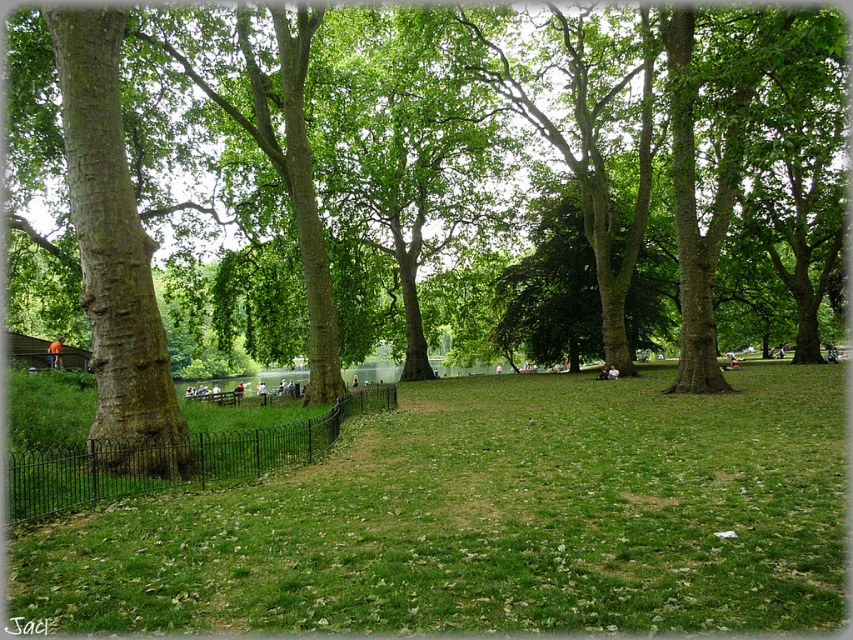
You are a gardener planning to plant a new tree in the park. You have a small sapling that needs space to grow. Based on the image, which area would be more suitable for planting the sapling? The green matte tree at left or the green grassy area at center?

The green grassy area at center is more suitable for planting the sapling since the green matte tree at left is already larger in size and may not leave enough space for the new sapling to grow properly.

You are standing at the lower left corner of the park and want to walk towards the green grassy area at center. Which direction should you move relative to the black wrought iron fence at lower left?

You should move to the right of the black wrought iron fence at lower left to reach the green grassy area at center since it is positioned to the right of the fence.